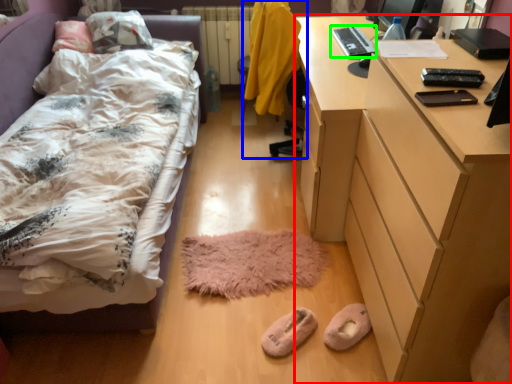
Question: Which object is the farthest from desk (highlighted by a red box)? Choose among these: swivel chair (highlighted by a blue box) or laptop (highlighted by a green box).

Choices:
 (A) swivel chair
 (B) laptop

Answer: (B)